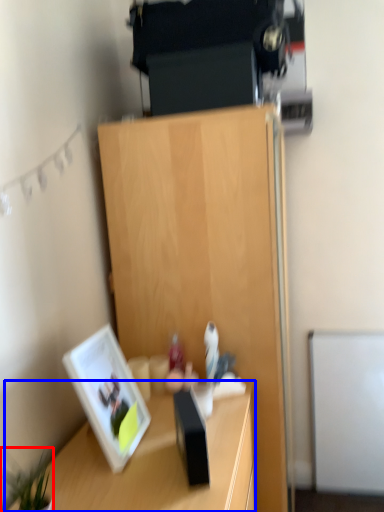
Question: Which of the following is the farthest to the observer, plant (highlighted by a red box) or desk (highlighted by a blue box)?

Choices:
 (A) plant
 (B) desk

Answer: (B)